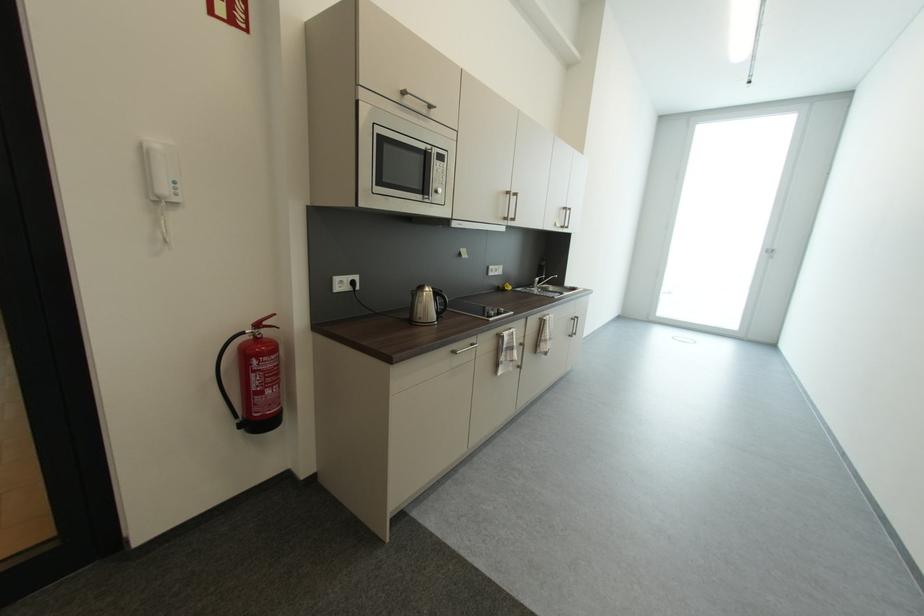
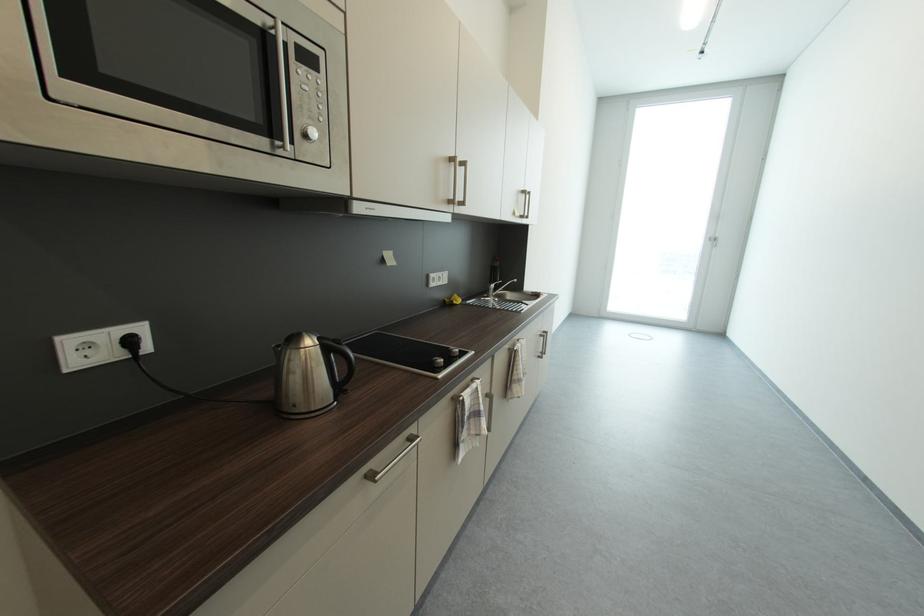
In the second image, find the point that corresponds to point 570,209 in the first image.

(529, 193)